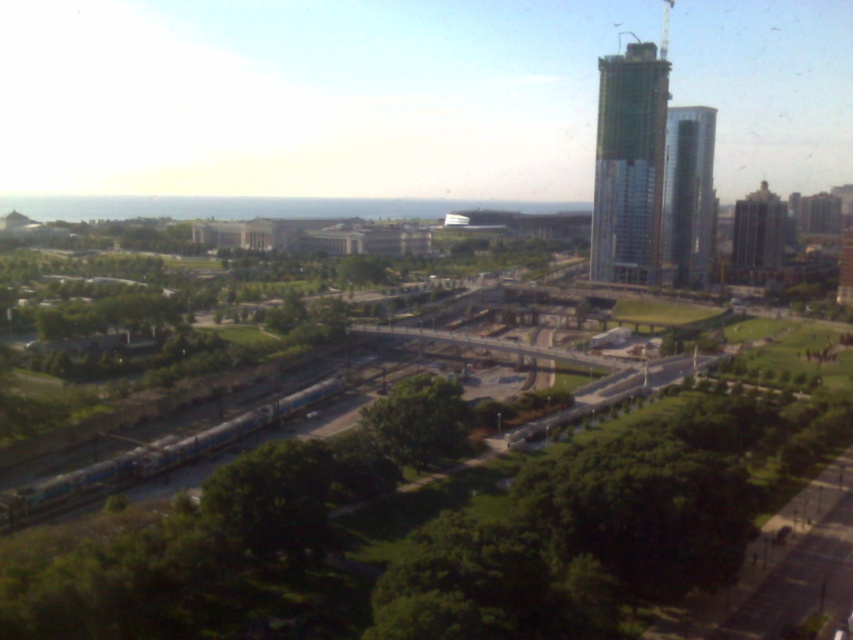
Is glassy silver skyscraper at right positioned behind brick textured building at right?

No.

Is glassy silver skyscraper at right above brick textured building at right?

Yes, glassy silver skyscraper at right is above brick textured building at right.

Between point (689, 220) and point (747, 257), which one is positioned in front?

Point (689, 220)

Locate an element on the screen. glassy silver skyscraper at right is located at coordinates (688, 195).

Does glassy silver skyscraper at right appear over green leafy tree at center?

Yes, glassy silver skyscraper at right is above green leafy tree at center.

Can you confirm if glassy silver skyscraper at right is positioned below green leafy tree at center?

Incorrect, glassy silver skyscraper at right is not positioned below green leafy tree at center.

Is point (703, 176) positioned in front of point (433, 428)?

No, it is not.

The width and height of the screenshot is (853, 640). Identify the location of glassy silver skyscraper at right. (688, 195).

Which is above, green glass building at upper right or brick textured building at right?

Positioned higher is brick textured building at right.

Who is shorter, green glass building at upper right or brick textured building at right?

With less height is brick textured building at right.

This screenshot has height=640, width=853. In order to click on green glass building at upper right in this screenshot , I will do `click(628, 164)`.

Locate an element on the screen. The image size is (853, 640). green glass building at upper right is located at coordinates pyautogui.click(x=628, y=164).